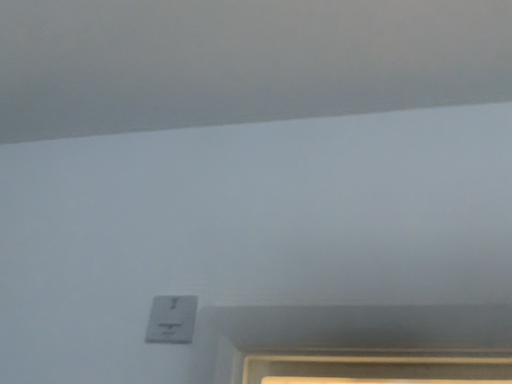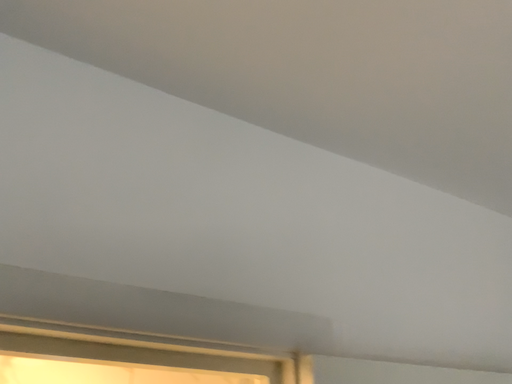
Question: Which way did the camera rotate in the video?

Choices:
 (A) rotated left
 (B) rotated right

Answer: (B)